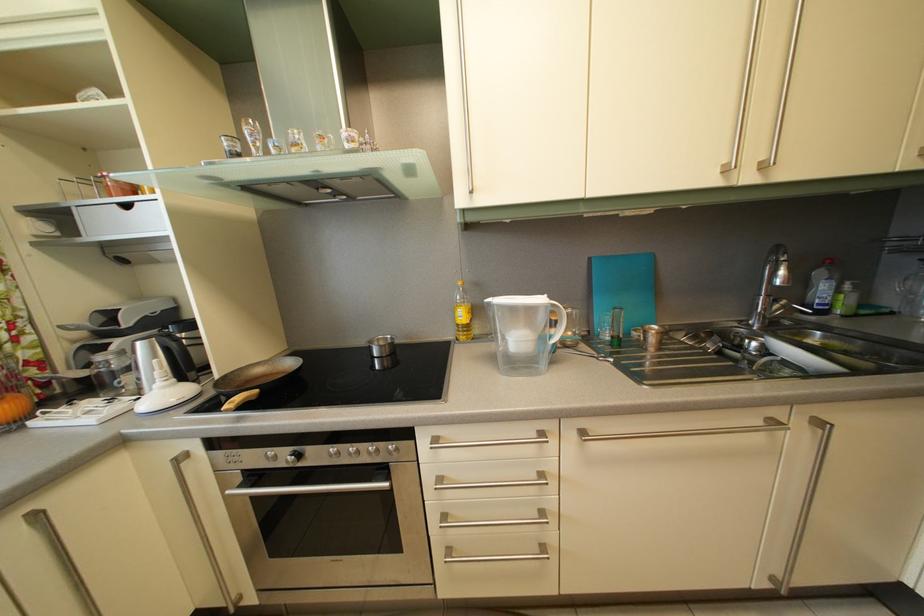
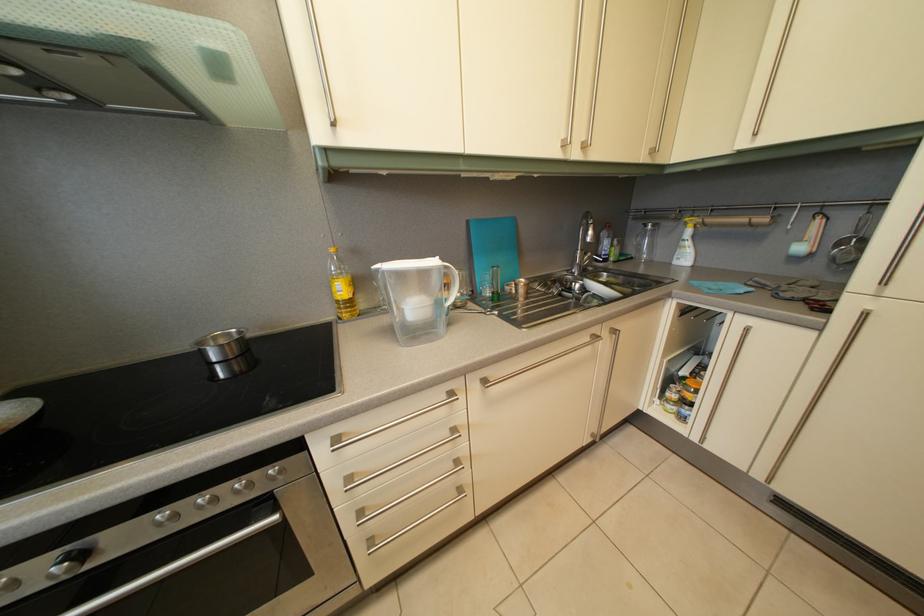
Locate, in the second image, the point that corresponds to pixel 360 456 in the first image.

(211, 505)